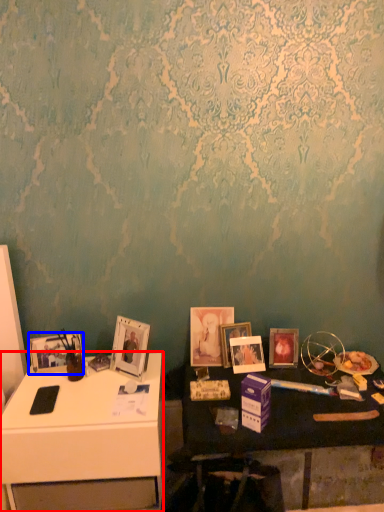
Question: Among these objects, which one is farthest to the camera, desk (highlighted by a red box) or picture frame (highlighted by a blue box)?

Choices:
 (A) desk
 (B) picture frame

Answer: (B)